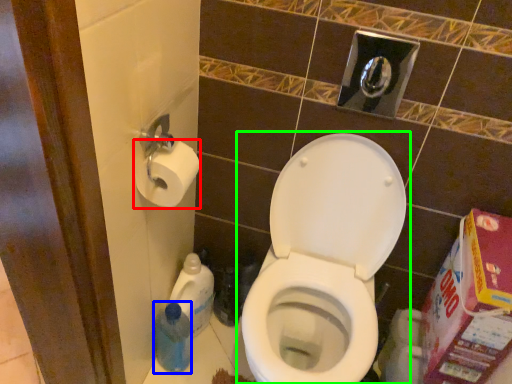
Question: Considering the real-world distances, which object is closest to toilet paper (highlighted by a red box)? cleaning product (highlighted by a blue box) or toilet (highlighted by a green box).

Choices:
 (A) cleaning product
 (B) toilet

Answer: (B)